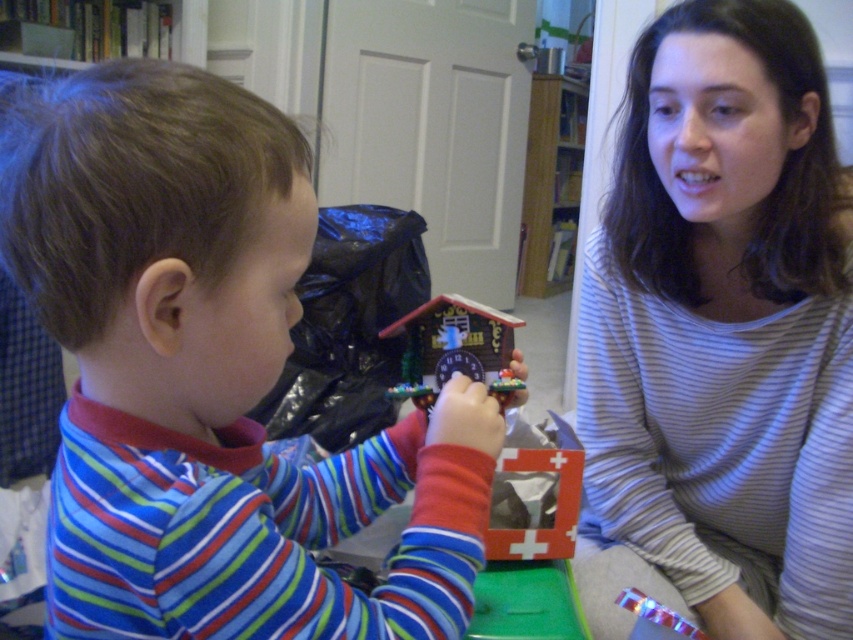
Question: Is striped cotton shirt at center positioned in front of wooden cuckoo clock at center?

Choices:
 (A) yes
 (B) no

Answer: (B)

Question: Which point is farther from the camera taking this photo?

Choices:
 (A) (412, 342)
 (B) (61, 339)
 (C) (755, 608)

Answer: (C)

Question: Which point appears closest to the camera in this image?

Choices:
 (A) (114, 113)
 (B) (436, 380)

Answer: (A)

Question: Is striped fabric shirt at left closer to the viewer compared to striped cotton shirt at center?

Choices:
 (A) yes
 (B) no

Answer: (A)

Question: Is striped fabric shirt at left positioned before wooden cuckoo clock at center?

Choices:
 (A) yes
 (B) no

Answer: (A)

Question: Which point is closer to the camera taking this photo?

Choices:
 (A) (473, 323)
 (B) (833, 211)

Answer: (A)